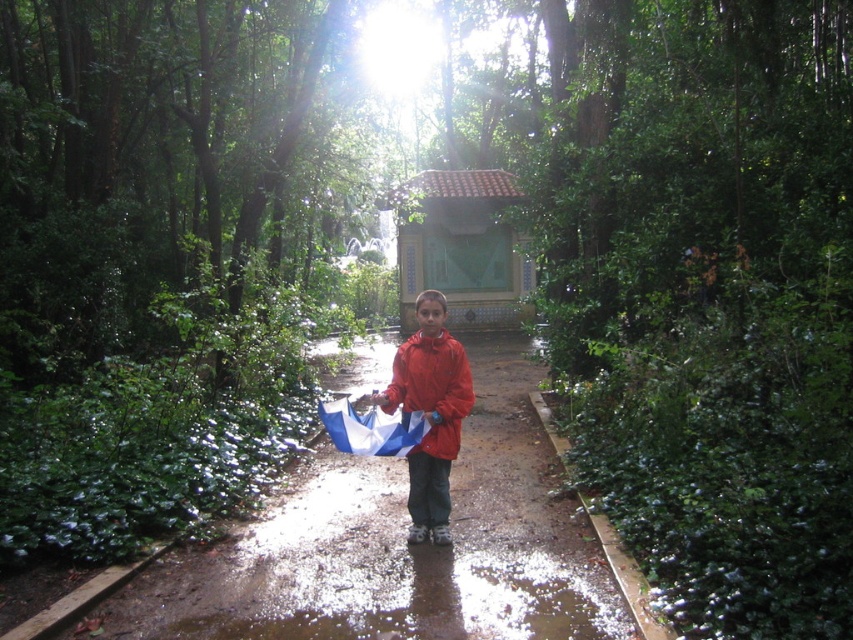
Is brown tiled gazebo at center taller than matte red jacket at center?

No.

Describe the element at coordinates (461, 248) in the screenshot. I see `brown tiled gazebo at center` at that location.

Identify the location of brown tiled gazebo at center. The width and height of the screenshot is (853, 640). (461, 248).

Does glossy concrete path at center have a greater height compared to matte red jacket at center?

No.

In the scene shown: Does glossy concrete path at center appear over matte red jacket at center?

Actually, glossy concrete path at center is below matte red jacket at center.

Describe the element at coordinates (393, 548) in the screenshot. I see `glossy concrete path at center` at that location.

Where is `glossy concrete path at center`? This screenshot has width=853, height=640. glossy concrete path at center is located at coordinates (393, 548).

Does glossy concrete path at center appear on the left side of red matte jacket at center?

No, glossy concrete path at center is not to the left of red matte jacket at center.

Can you confirm if glossy concrete path at center is positioned above red matte jacket at center?

Actually, glossy concrete path at center is below red matte jacket at center.

Describe the element at coordinates (393, 548) in the screenshot. This screenshot has height=640, width=853. I see `glossy concrete path at center` at that location.

Where is `glossy concrete path at center`? This screenshot has height=640, width=853. glossy concrete path at center is located at coordinates (393, 548).